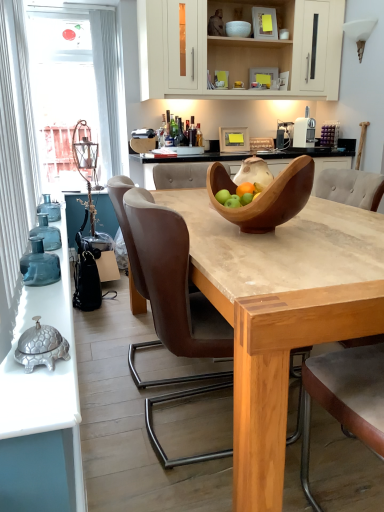
Locate an element on the screen. This screenshot has height=512, width=384. vacant area that is in front of wooden bowl at center, which is the 2th bowl from back to front is located at coordinates (281, 252).